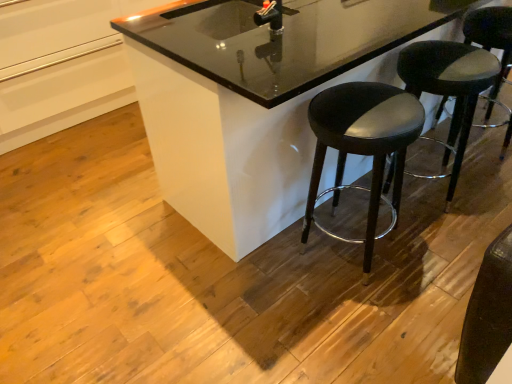
Where is `vacant area that is situated to the right of black leather stool at center, which is the 3th stool in right-to-left order`? vacant area that is situated to the right of black leather stool at center, which is the 3th stool in right-to-left order is located at coordinates (430, 258).